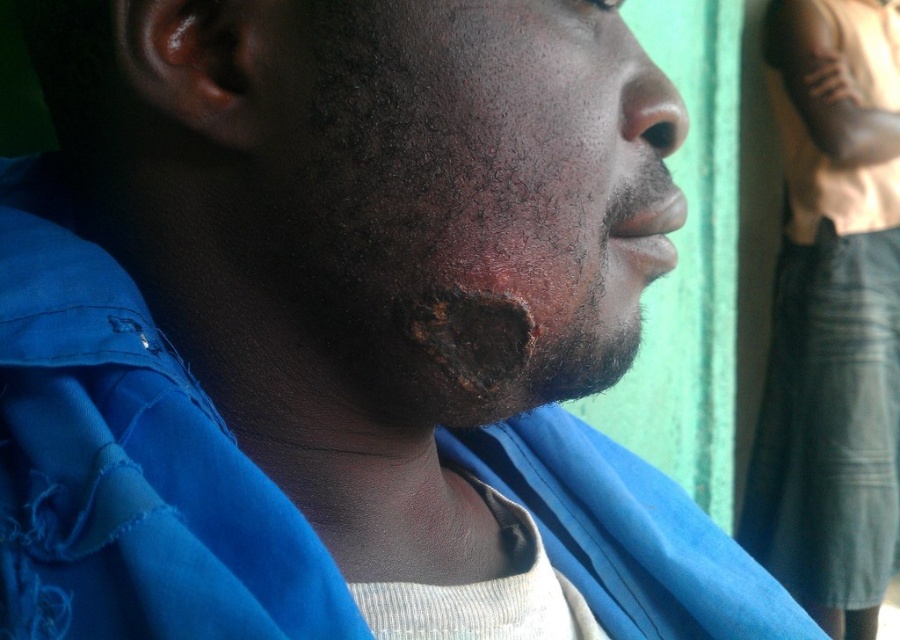
Is dry skin at center to the left of smooth skin nose at center from the viewer's perspective?

Correct, you'll find dry skin at center to the left of smooth skin nose at center.

Does dry skin at center have a larger size compared to smooth skin nose at center?

Indeed, dry skin at center has a larger size compared to smooth skin nose at center.

Describe the element at coordinates (468, 193) in the screenshot. I see `dry skin at center` at that location.

I want to click on dry skin at center, so click(468, 193).

Can you confirm if dry skin at center is taller than dark blue fabric at center?

No.

Does point (472, 273) come behind point (878, 396)?

No.

Identify the location of dry skin at center. (468, 193).

Is dark blue fabric at center positioned in front of smooth skin nose at center?

No, it is not.

Can you confirm if dark blue fabric at center is positioned below smooth skin nose at center?

Correct, dark blue fabric at center is located below smooth skin nose at center.

Which is in front, point (861, 442) or point (630, 88)?

Point (630, 88) is more forward.

This screenshot has height=640, width=900. In order to click on dark blue fabric at center in this screenshot , I will do `click(832, 316)`.